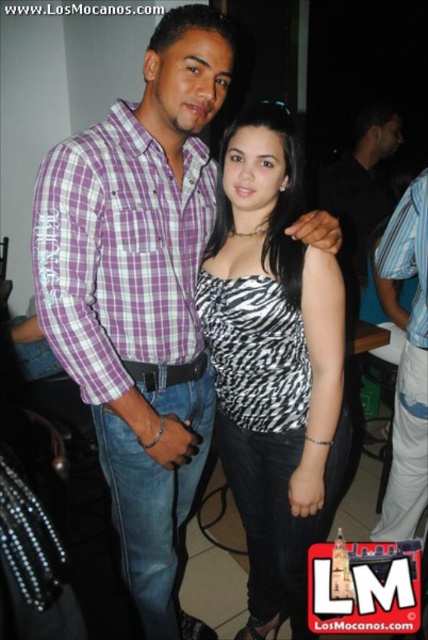
You are a photographer at a social event and need to adjust the lighting to ensure both the zebra print top at center and the striped shirt at right are equally visible. Given their height difference, how should you position the lights?

The zebra print top at center is taller than the striped shirt at right. To balance visibility, position the lights so they illuminate the taller zebra print top at center from above and the shorter striped shirt at right from below, ensuring both receive adequate light distribution.

You are at a party and want to take a photo of the zebra print top at center and the striped shirt at right. Which one should you focus on first if you want to capture both in the frame?

The zebra print top at center is below the striped shirt at right, so you should focus on the striped shirt at right first to ensure both are in the frame.

You are at a party and want to take a photo of both the purple checkered shirt at center and the striped shirt at right. However, you can only focus on one shirt at a time. Which shirt should you focus on to ensure the other is still visible in the background?

You should focus on the purple checkered shirt at center because it is in front of the striped shirt at right, so the striped shirt at right will still be visible in the background.